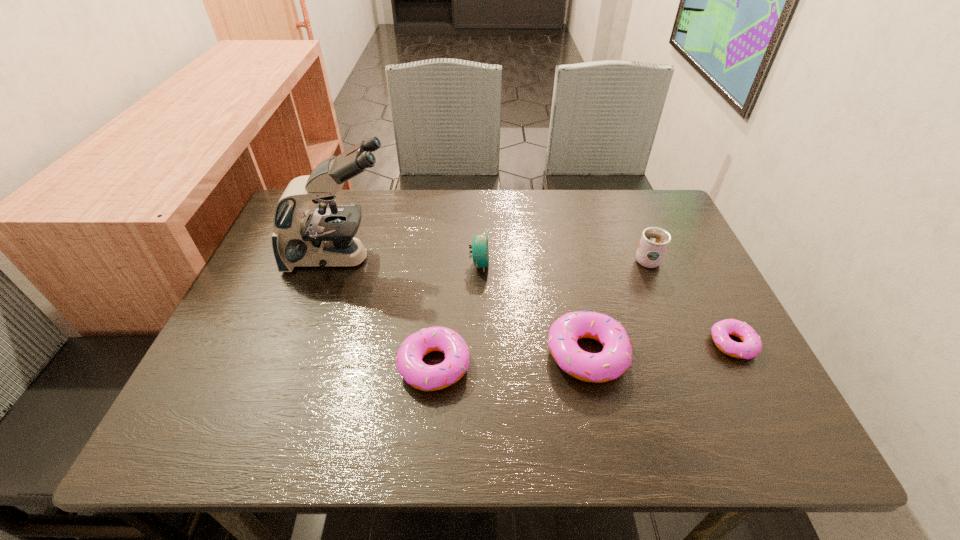
Find the location of `blank space located 0.060m on the back of the leftmost doughnut`. blank space located 0.060m on the back of the leftmost doughnut is located at coordinates (439, 316).

The width and height of the screenshot is (960, 540). I want to click on free location located 0.120m on the back of the second doughnut from left to right, so click(x=572, y=285).

Image resolution: width=960 pixels, height=540 pixels. I want to click on free region located on the back of the rightmost object, so click(676, 232).

This screenshot has width=960, height=540. I want to click on vacant space situated 0.140m on the side with the handle of the cup, so click(629, 215).

The height and width of the screenshot is (540, 960). I want to click on vacant position located 0.240m on the side with the handle of the cup, so click(x=621, y=195).

Image resolution: width=960 pixels, height=540 pixels. What are the coordinates of `vacant space located 0.050m on the side with the handle of the cup` in the screenshot? It's located at (636, 234).

Locate an element on the screen. This screenshot has width=960, height=540. vacant area located 0.200m through the eyepieces of the leftmost object is located at coordinates tap(473, 258).

This screenshot has width=960, height=540. I want to click on vacant region located 0.330m on the front-facing side of the fourth shortest object, so click(x=618, y=264).

I want to click on object located in the far edge section of the desktop, so click(x=323, y=237).

I want to click on object situated at the left edge, so click(323, 237).